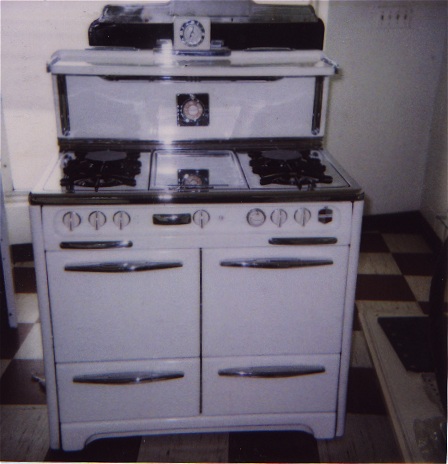
I want to click on handles, so click(x=95, y=244), click(x=121, y=267), click(x=130, y=378), click(x=257, y=372), click(x=262, y=262), click(x=289, y=239).